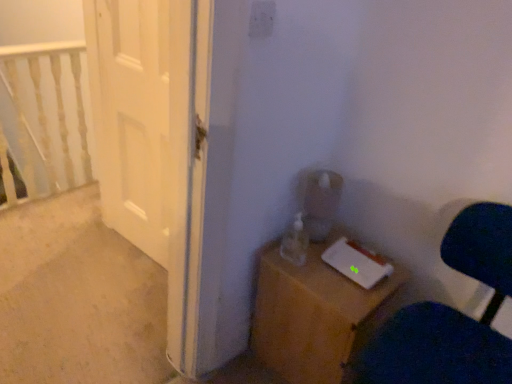
The height and width of the screenshot is (384, 512). What do you see at coordinates (451, 315) in the screenshot?
I see `velvet dark blue chair at lower right` at bounding box center [451, 315].

Locate an element on the screen. The height and width of the screenshot is (384, 512). velvet dark blue chair at lower right is located at coordinates (451, 315).

How distant is velvet dark blue chair at lower right from white painted wood railing at upper left?

velvet dark blue chair at lower right is 2.21 meters away from white painted wood railing at upper left.

Between velvet dark blue chair at lower right and white painted wood railing at upper left, which one is positioned in front?

velvet dark blue chair at lower right.

Can we say velvet dark blue chair at lower right lies outside white painted wood railing at upper left?

velvet dark blue chair at lower right lies outside white painted wood railing at upper left's area.

From the image's perspective, is velvet dark blue chair at lower right located above or below white painted wood railing at upper left?

Based on their image positions, velvet dark blue chair at lower right is located beneath white painted wood railing at upper left.

In the image, is white glossy door at left positioned in front of or behind wooden nightstand at lower right?

white glossy door at left is positioned farther from the viewer than wooden nightstand at lower right.

Based on the photo, how different are the orientations of white glossy door at left and wooden nightstand at lower right in degrees?

white glossy door at left and wooden nightstand at lower right are facing 89.2 degrees away from each other.

Is white glossy door at left to the left of wooden nightstand at lower right from the viewer's perspective?

Yes.

Is white glossy door at left next to wooden nightstand at lower right?

white glossy door at left is not next to wooden nightstand at lower right, and they're not touching.

At what (x,y) coordinates should I click in order to perform the action: click on furniture below the white painted wood railing at upper left (from the image's perspective). Please return your answer as a coordinate pair (x, y). The height and width of the screenshot is (384, 512). Looking at the image, I should click on (316, 315).

Is point (30, 62) farther from camera compared to point (371, 293)?

Yes, it is.

Considering the relative sizes of white painted wood railing at upper left and wooden nightstand at lower right in the image provided, is white painted wood railing at upper left smaller than wooden nightstand at lower right?

No, white painted wood railing at upper left is not smaller than wooden nightstand at lower right.

Is white painted wood railing at upper left placed right next to wooden nightstand at lower right?

white painted wood railing at upper left and wooden nightstand at lower right are not in contact.

Would you say velvet dark blue chair at lower right is to the left or to the right of white glossy door at left in the picture?

In the image, velvet dark blue chair at lower right appears on the right side of white glossy door at left.

Considering the positions of point (416, 338) and point (149, 200), is point (416, 338) closer or farther from the camera than point (149, 200)?

Point (416, 338) is closer to the camera than point (149, 200).

What's the angular difference between velvet dark blue chair at lower right and white glossy door at left's facing directions?

The angle between the facing direction of velvet dark blue chair at lower right and the facing direction of white glossy door at left is 2.22 degrees.

Is velvet dark blue chair at lower right facing towards white glossy door at left?

No, velvet dark blue chair at lower right is not aimed at white glossy door at left.

Is white glossy door at left inside wooden nightstand at lower right?

Actually, white glossy door at left is outside wooden nightstand at lower right.

Is wooden nightstand at lower right at the right side of white glossy door at left?

Indeed, wooden nightstand at lower right is positioned on the right side of white glossy door at left.

Is white glossy door at left at the back of wooden nightstand at lower right?

Yes, wooden nightstand at lower right's orientation is away from white glossy door at left.

From a real-world perspective, is wooden nightstand at lower right positioned under white painted wood railing at upper left based on gravity?

Yes, from a real-world perspective, wooden nightstand at lower right is beneath white painted wood railing at upper left.

Is wooden nightstand at lower right positioned with its back to white painted wood railing at upper left?

Yes, wooden nightstand at lower right is facing away from white painted wood railing at upper left.

In terms of height, does wooden nightstand at lower right look taller or shorter compared to white painted wood railing at upper left?

Clearly, wooden nightstand at lower right is shorter compared to white painted wood railing at upper left.

Between wooden nightstand at lower right and white painted wood railing at upper left, which one has smaller size?

wooden nightstand at lower right.

Based on the photo, can you confirm if white glossy door at left is positioned to the left of velvet dark blue chair at lower right?

Yes.

Does point (150, 211) appear closer or farther from the camera than point (502, 257)?

Clearly, point (150, 211) is more distant from the camera than point (502, 257).

Is white glossy door at left completely or partially outside of velvet dark blue chair at lower right?

Indeed, white glossy door at left is completely outside velvet dark blue chair at lower right.

Can you tell me how much white glossy door at left and velvet dark blue chair at lower right differ in facing direction?

They differ by 2.22 degrees in their facing directions.

At what (x,y) coordinates should I click in order to perform the action: click on rail on the left of velvet dark blue chair at lower right. Please return your answer as a coordinate pair (x, y). This screenshot has width=512, height=384. Looking at the image, I should click on (46, 115).

Image resolution: width=512 pixels, height=384 pixels. What are the coordinates of `furniture located underneath the white glossy door at left (from a real-world perspective)` in the screenshot? It's located at (316, 315).

When comparing their distances from white glossy door at left, does white painted wood railing at upper left or velvet dark blue chair at lower right seem closer?

Based on the image, white painted wood railing at upper left appears to be nearer to white glossy door at left.

When comparing their distances from wooden nightstand at lower right, does white glossy door at left or velvet dark blue chair at lower right seem closer?

velvet dark blue chair at lower right.

Considering their positions, is white glossy door at left positioned further to white painted wood railing at upper left than velvet dark blue chair at lower right?

velvet dark blue chair at lower right.

When comparing their distances from white painted wood railing at upper left, does wooden nightstand at lower right or velvet dark blue chair at lower right seem closer?

The object closer to white painted wood railing at upper left is wooden nightstand at lower right.

Which object lies further to the anchor point white glossy door at left, velvet dark blue chair at lower right or wooden nightstand at lower right?

velvet dark blue chair at lower right lies further to white glossy door at left than the other object.

Based on their spatial positions, is white painted wood railing at upper left or velvet dark blue chair at lower right closer to wooden nightstand at lower right?

The object closer to wooden nightstand at lower right is velvet dark blue chair at lower right.

Based on their spatial positions, is white glossy door at left or wooden nightstand at lower right further from white painted wood railing at upper left?

wooden nightstand at lower right is positioned further to the anchor white painted wood railing at upper left.

When comparing their distances from white glossy door at left, does white painted wood railing at upper left or wooden nightstand at lower right seem closer?

white painted wood railing at upper left.

Locate an element on the screen. furniture located between white painted wood railing at upper left and velvet dark blue chair at lower right in the left-right direction is located at coordinates (316, 315).

Identify the location of door between white painted wood railing at upper left and velvet dark blue chair at lower right. This screenshot has width=512, height=384. (132, 116).

Where is `furniture located between white glossy door at left and velvet dark blue chair at lower right in the left-right direction`? furniture located between white glossy door at left and velvet dark blue chair at lower right in the left-right direction is located at coordinates (316, 315).

The width and height of the screenshot is (512, 384). Find the location of `door located between white painted wood railing at upper left and wooden nightstand at lower right in the left-right direction`. door located between white painted wood railing at upper left and wooden nightstand at lower right in the left-right direction is located at coordinates (132, 116).